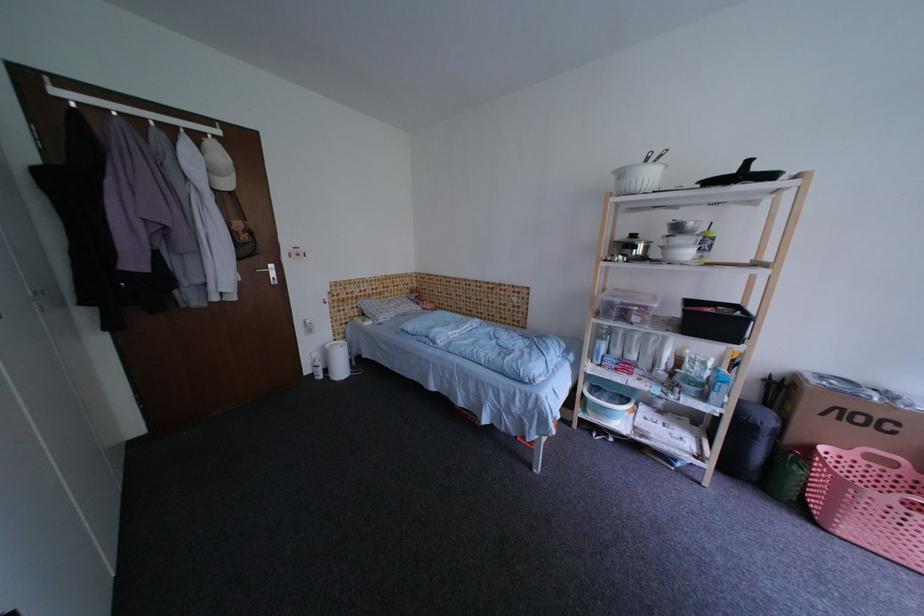
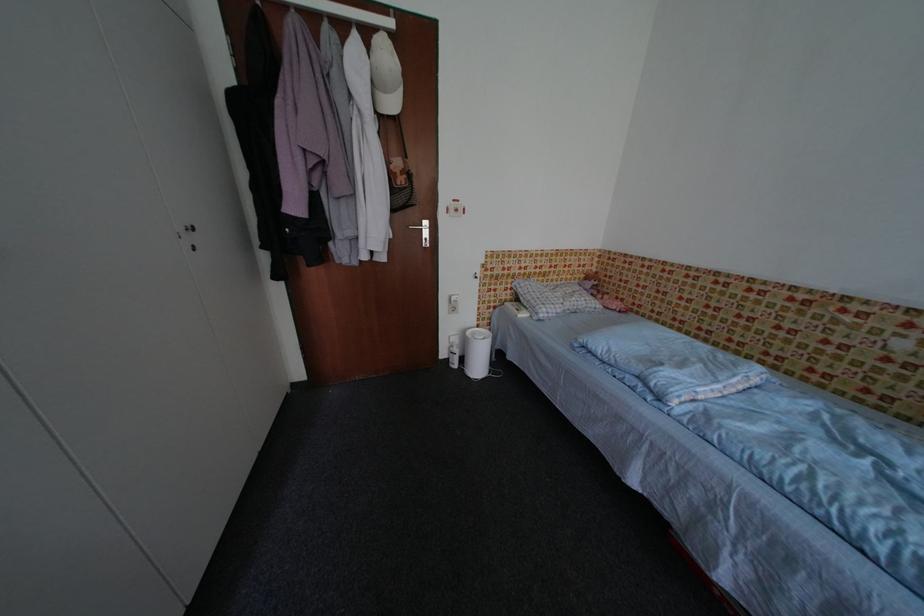
In the second image, find the point that corresponds to point 406,297 in the first image.

(574, 282)